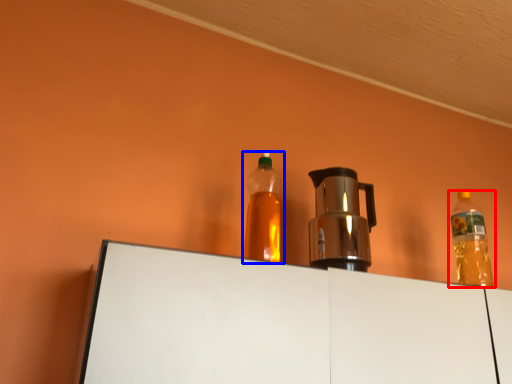
Question: Which object appears farthest to the camera in this image, bottle (highlighted by a red box) or bottle (highlighted by a blue box)?

Choices:
 (A) bottle
 (B) bottle

Answer: (A)